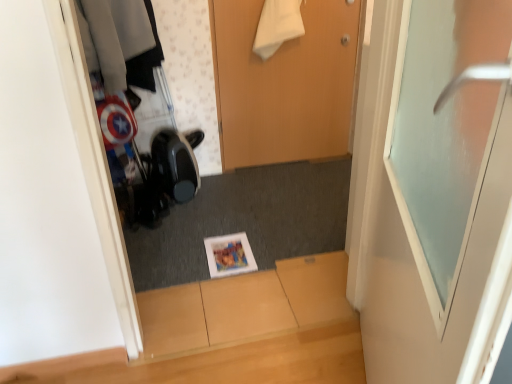
In order to click on vacant space in front of wooden door at center, which is the first door in back-to-front order in this screenshot , I will do `click(285, 190)`.